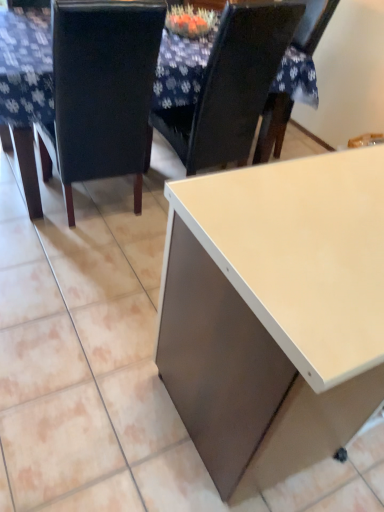
You are a GUI agent. You are given a task and a screenshot of the screen. Output one action in this format:
    pyautogui.click(x=<x>, y=<y>)
    Task: Click on the free point to the left of matte white desk at lower right
    This screenshot has width=384, height=512.
    Given the screenshot: What is the action you would take?
    pyautogui.click(x=87, y=357)